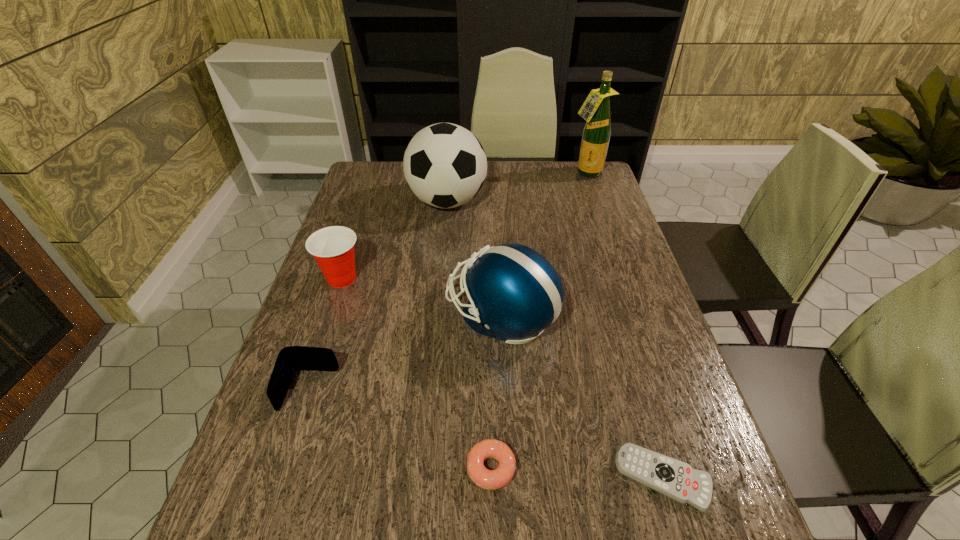
Where is `the farthest object`? The height and width of the screenshot is (540, 960). the farthest object is located at coordinates (596, 109).

What are the coordinates of `the tallest object` in the screenshot? It's located at (596, 109).

Find the location of a particular element. This screenshot has width=960, height=540. the sixth nearest object is located at coordinates (445, 166).

I want to click on soccer ball, so click(x=445, y=166).

The width and height of the screenshot is (960, 540). What are the coordinates of `football helmet` in the screenshot? It's located at (514, 293).

Locate an element on the screen. the fourth shortest object is located at coordinates (332, 247).

This screenshot has width=960, height=540. I want to click on the fifth tallest object, so [292, 358].

I want to click on wallet, so click(292, 358).

Where is `doughnut`? The width and height of the screenshot is (960, 540). doughnut is located at coordinates (489, 448).

This screenshot has height=540, width=960. What are the coordinates of `remote control` in the screenshot? It's located at (675, 479).